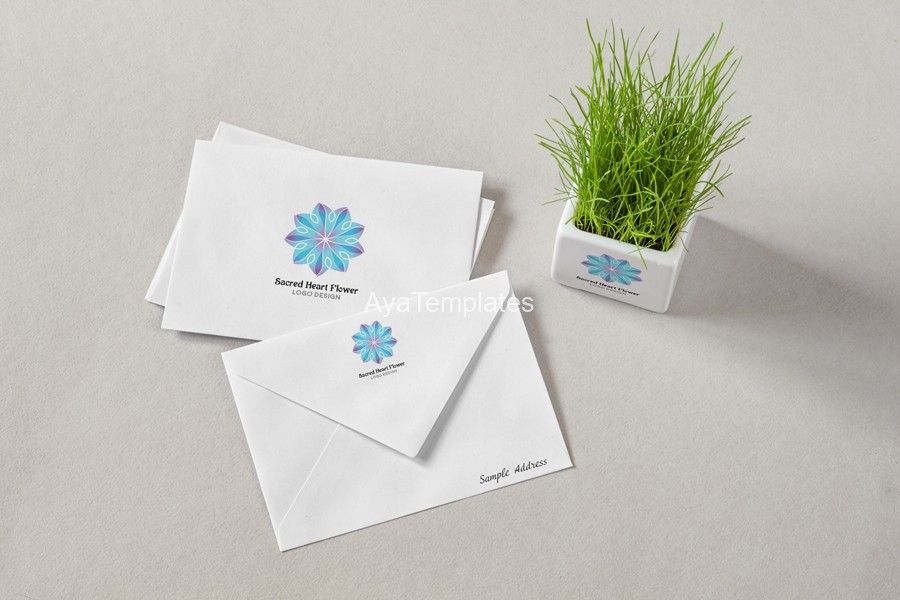
Identify the location of square planter. (661, 281).